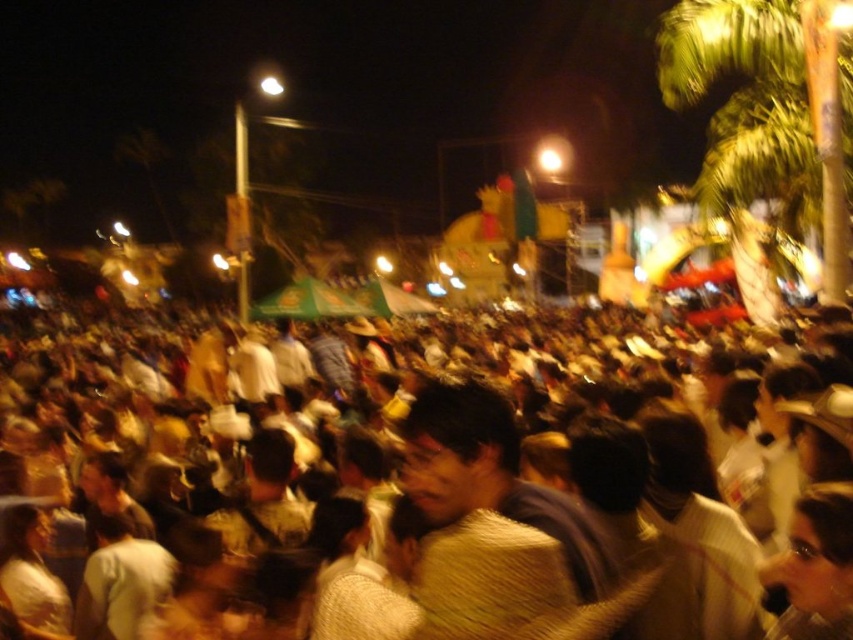
Question: Does brown textured crowd at center have a larger size compared to green leafy palm tree at upper right?

Choices:
 (A) no
 (B) yes

Answer: (B)

Question: Which point is farther from the camera taking this photo?

Choices:
 (A) (761, 45)
 (B) (596, 340)

Answer: (B)

Question: Is brown textured crowd at center positioned in front of green leafy palm tree at upper right?

Choices:
 (A) no
 (B) yes

Answer: (B)

Question: Is brown textured crowd at center to the left of green leafy palm tree at upper right from the viewer's perspective?

Choices:
 (A) no
 (B) yes

Answer: (B)

Question: Which object appears closest to the camera in this image?

Choices:
 (A) brown textured crowd at center
 (B) green leafy palm tree at upper right

Answer: (A)